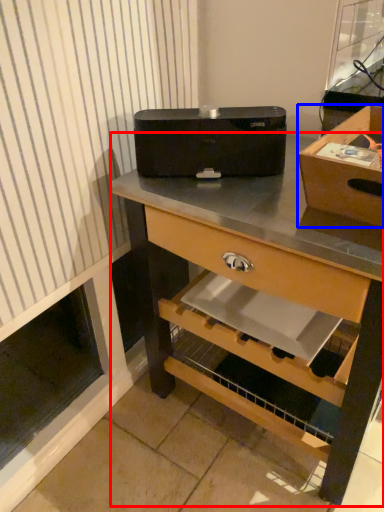
Question: Among these objects, which one is nearest to the camera, desk (highlighted by a red box) or box (highlighted by a blue box)?

Choices:
 (A) desk
 (B) box

Answer: (A)